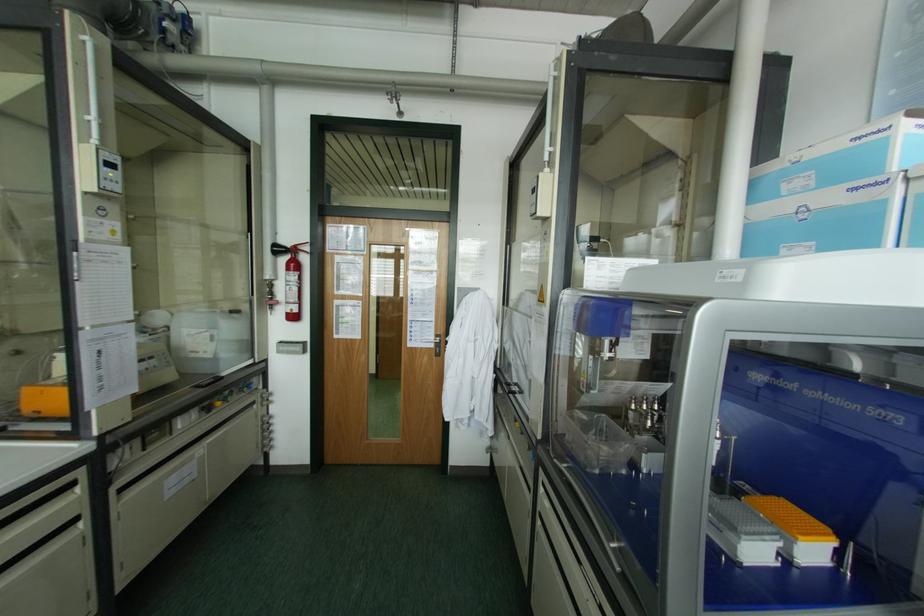
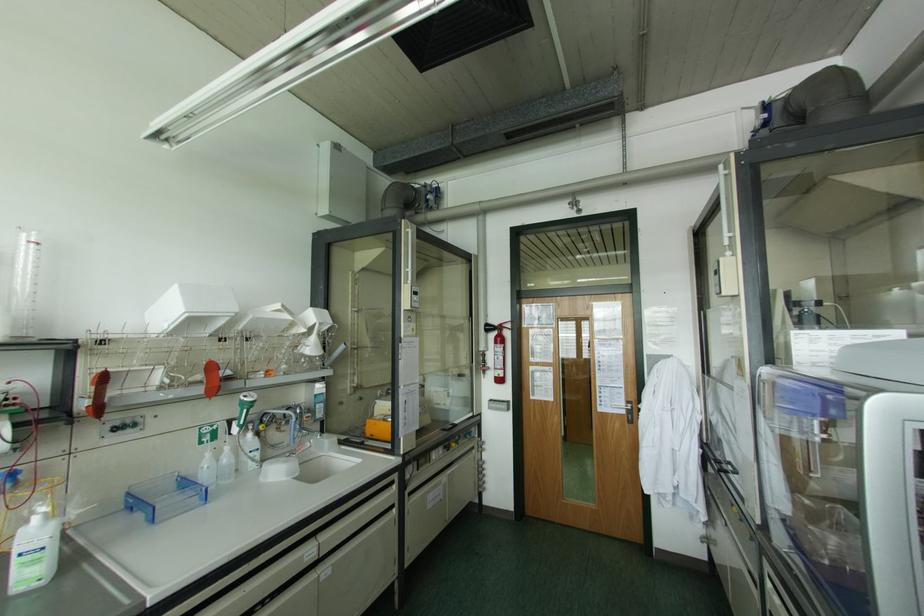
Find the pixel in the second image that matches point (435, 334) in the first image.

(626, 400)